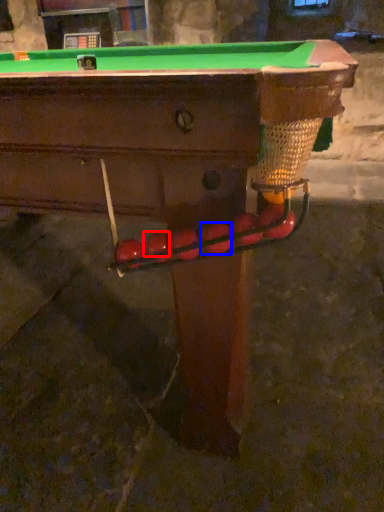
Question: Among these objects, which one is farthest to the camera, fruit (highlighted by a red box) or fruit (highlighted by a blue box)?

Choices:
 (A) fruit
 (B) fruit

Answer: (A)